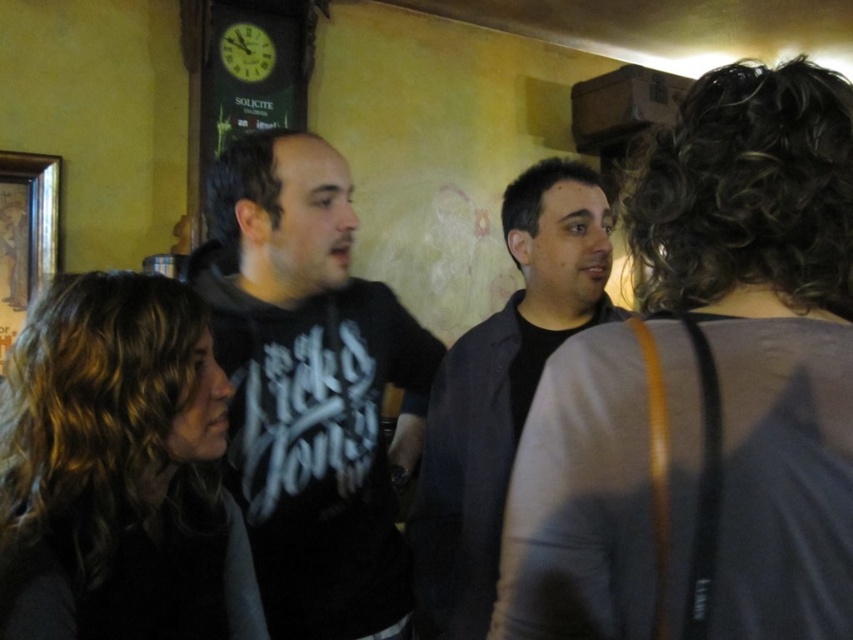
What is located at the coordinates point (x=701, y=387)?

The gray fabric purse at upper right is located at point (x=701, y=387).

You are trying to identify two items in the scene based on their thickness. You notice a dark brown hair at center and a dark gray jacket at center. Which of these two items is thinner?

The dark brown hair at center is thinner than the dark gray jacket at center.

You are at a social gathering and notice two items in the scene. One is a gray fabric purse at upper right and the other is dark brown hair at center. Which item is positioned more to the east in the image?

The gray fabric purse at upper right is positioned to the right of dark brown hair at center, so it is more to the east in the image.